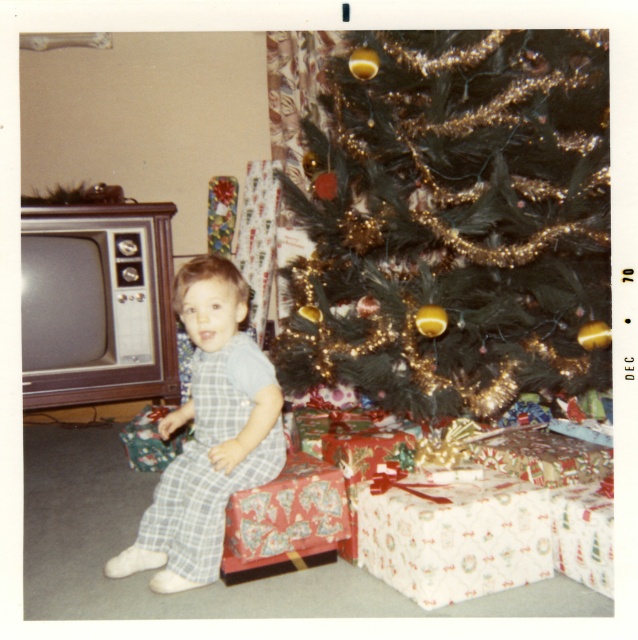
Does point (309, 122) come farther from viewer compared to point (161, 484)?

Yes.

Is green textured christmas tree at center smaller than plaid pajamas at center?

Actually, green textured christmas tree at center might be larger than plaid pajamas at center.

Is point (313, 346) in front of point (188, 472)?

No, (313, 346) is further to viewer.

Locate an element on the screen. green textured christmas tree at center is located at coordinates (454, 220).